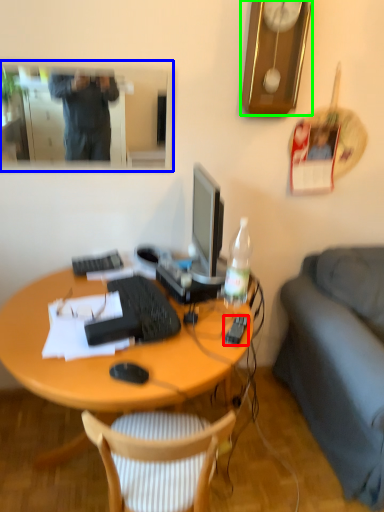
Question: Based on their relative distances, which object is nearer to remote control (highlighted by a red box)? Choose from mirror (highlighted by a blue box) and clock (highlighted by a green box).

Choices:
 (A) mirror
 (B) clock

Answer: (B)